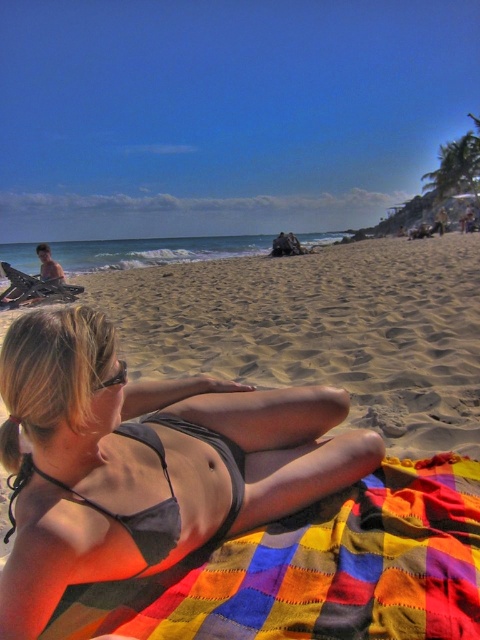
Does multicolored patchwork blanket at lower center appear on the right side of gray matte bikini at center?

Yes, multicolored patchwork blanket at lower center is to the right of gray matte bikini at center.

Where is `multicolored patchwork blanket at lower center`? The height and width of the screenshot is (640, 480). multicolored patchwork blanket at lower center is located at coordinates (317, 570).

Between point (264, 536) and point (121, 429), which one is positioned in front?

Point (121, 429) is in front.

The width and height of the screenshot is (480, 640). I want to click on multicolored patchwork blanket at lower center, so click(317, 570).

Is matte gray bikini at center closer to camera compared to multicolored patchwork blanket at lower center?

Result: That is True.

The width and height of the screenshot is (480, 640). Describe the element at coordinates (144, 461) in the screenshot. I see `matte gray bikini at center` at that location.

The width and height of the screenshot is (480, 640). I want to click on matte gray bikini at center, so click(144, 461).

Between point (109, 512) and point (229, 467), which one is positioned in front?

Point (109, 512)

Consider the image. Between matte gray bikini at center and gray matte bikini at center, which one has less height?

With less height is gray matte bikini at center.

This screenshot has width=480, height=640. Find the location of `matte gray bikini at center`. matte gray bikini at center is located at coordinates (144, 461).

Find the location of `matte gray bikini at center`. matte gray bikini at center is located at coordinates (144, 461).